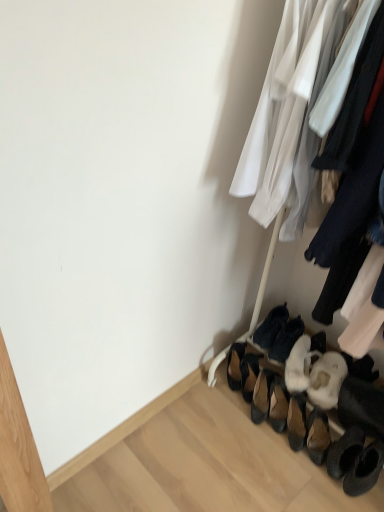
Question: Is black suede heels at lower right, the first footwear when ordered from left to right, to the left or to the right of dark blue suede shoes at lower right, the 1th footwear in the right-to-left sequence, in the image?

Choices:
 (A) left
 (B) right

Answer: (A)

Question: From the image's perspective, is black suede heels at lower right, the 4th footwear in the right-to-left sequence, located above or below dark blue suede shoes at lower right, the fourth footwear from the left?

Choices:
 (A) above
 (B) below

Answer: (B)

Question: Which object is positioned farthest from the dark blue suede shoes at lower right, which is the third footwear in left-to-right order?

Choices:
 (A) black suede heels at lower right, the 4th footwear in the right-to-left sequence
 (B) leather/textured shoe at lower center, which is the 3th footwear from right to left
 (C) dark blue suede shoes at lower right, the 1th footwear in the right-to-left sequence

Answer: (A)

Question: Estimate the real-world distances between objects in this image. Which object is closer to the black suede heels at lower right, the 4th footwear in the right-to-left sequence?

Choices:
 (A) dark blue suede shoes at lower right, the fourth footwear from the left
 (B) leather/textured shoe at lower center, placed as the second footwear when sorted from left to right
 (C) dark blue suede shoes at lower right, which is the second footwear in right-to-left order

Answer: (B)